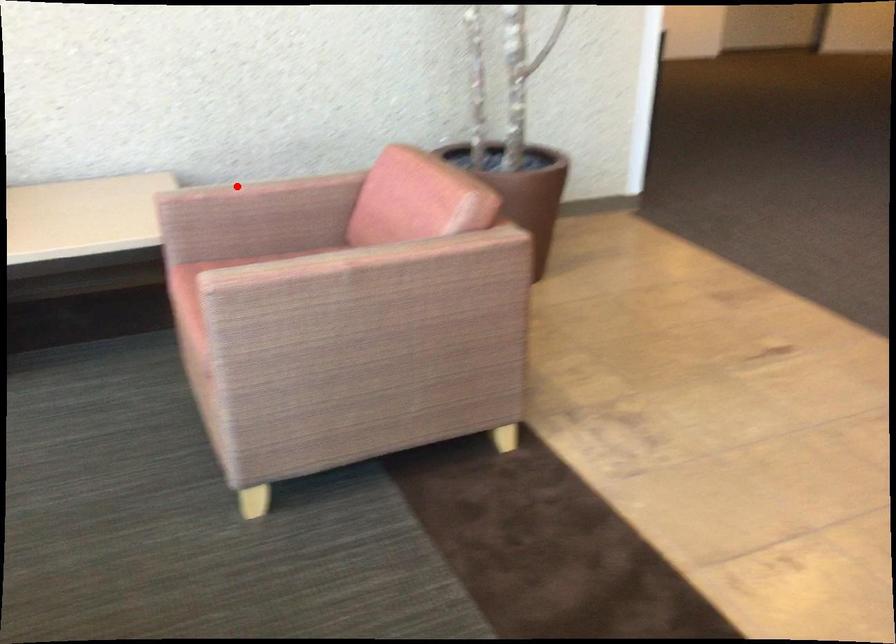
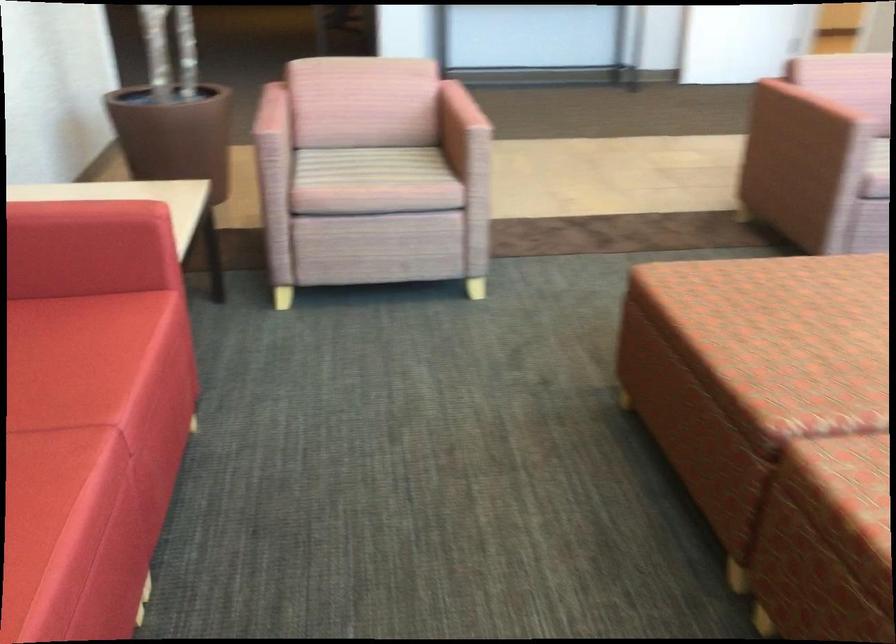
Question: A red point is marked in image1. In image2, is the corresponding 3D point closer to the camera or farther? Reply with the corresponding letter.

Choices:
 (A) The corresponding 3D point is closer.
 (B) The corresponding 3D point is farther.

Answer: (B)